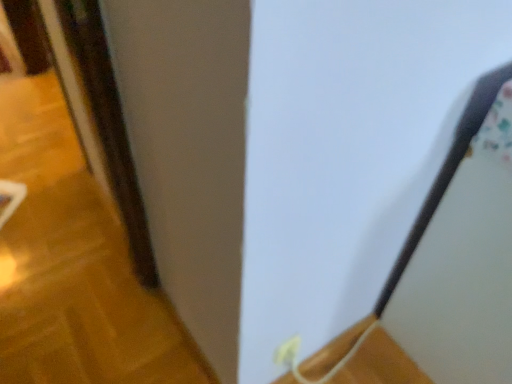
Question: Considering the positions of wooden at lower right and white plastic electric outlet at lower center in the image, is wooden at lower right taller or shorter than white plastic electric outlet at lower center?

Choices:
 (A) short
 (B) tall

Answer: (A)

Question: Is wooden at lower right spatially inside white plastic electric outlet at lower center, or outside of it?

Choices:
 (A) inside
 (B) outside

Answer: (B)

Question: Which of these objects is positioned closest to the white plastic electric outlet at lower center?

Choices:
 (A) brown wooden door at left
 (B) wooden at lower right

Answer: (B)

Question: Estimate the real-world distances between objects in this image. Which object is closer to the white plastic electric outlet at lower center?

Choices:
 (A) wooden at lower right
 (B) brown wooden door at left

Answer: (A)